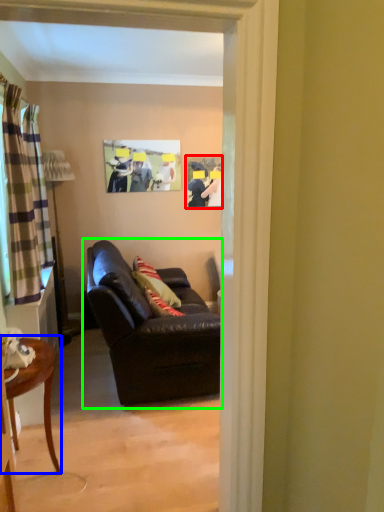
Question: Which is farther away from picture frame (highlighted by a red box)? table (highlighted by a blue box) or studio couch (highlighted by a green box)?

Choices:
 (A) table
 (B) studio couch

Answer: (A)